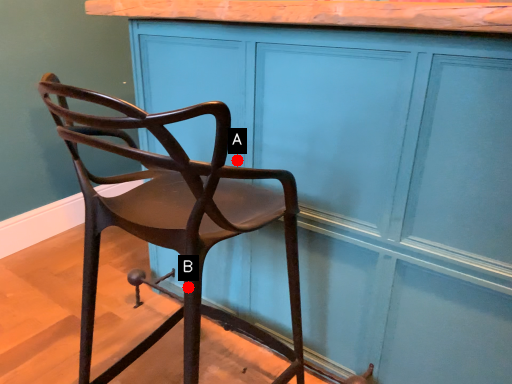
Question: Two points are circled on the image, labeled by A and B beside each circle. Which point is closer to the camera?

Choices:
 (A) A is closer
 (B) B is closer

Answer: (B)